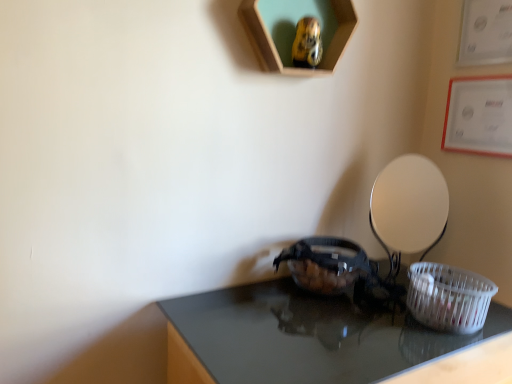
Question: From the image's perspective, would you say shiny black table at center is positioned over white plastic basket at lower right?

Choices:
 (A) yes
 (B) no

Answer: (B)

Question: Considering the relative sizes of shiny black table at center and white plastic basket at lower right in the image provided, is shiny black table at center smaller than white plastic basket at lower right?

Choices:
 (A) yes
 (B) no

Answer: (B)

Question: Can you confirm if shiny black table at center is positioned to the left of white plastic basket at lower right?

Choices:
 (A) no
 (B) yes

Answer: (B)

Question: From a real-world perspective, is shiny black table at center positioned under white plastic basket at lower right based on gravity?

Choices:
 (A) yes
 (B) no

Answer: (A)

Question: Is shiny black table at center next to white plastic basket at lower right and touching it?

Choices:
 (A) no
 (B) yes

Answer: (A)

Question: Can you confirm if shiny black table at center is wider than white plastic basket at lower right?

Choices:
 (A) yes
 (B) no

Answer: (A)

Question: Can you confirm if white plastic basket at lower right is bigger than shiny black table at center?

Choices:
 (A) yes
 (B) no

Answer: (B)

Question: Is white plastic basket at lower right located outside shiny black table at center?

Choices:
 (A) yes
 (B) no

Answer: (A)

Question: Is shiny black table at center at the back of white plastic basket at lower right?

Choices:
 (A) yes
 (B) no

Answer: (B)

Question: Is white plastic basket at lower right closer to the viewer compared to shiny black table at center?

Choices:
 (A) yes
 (B) no

Answer: (B)

Question: Is white plastic basket at lower right aimed at shiny black table at center?

Choices:
 (A) yes
 (B) no

Answer: (B)

Question: Does white plastic basket at lower right touch shiny black table at center?

Choices:
 (A) yes
 (B) no

Answer: (B)

Question: Looking at the image, does white plastic basket at lower right seem bigger or smaller compared to shiny black table at center?

Choices:
 (A) big
 (B) small

Answer: (B)